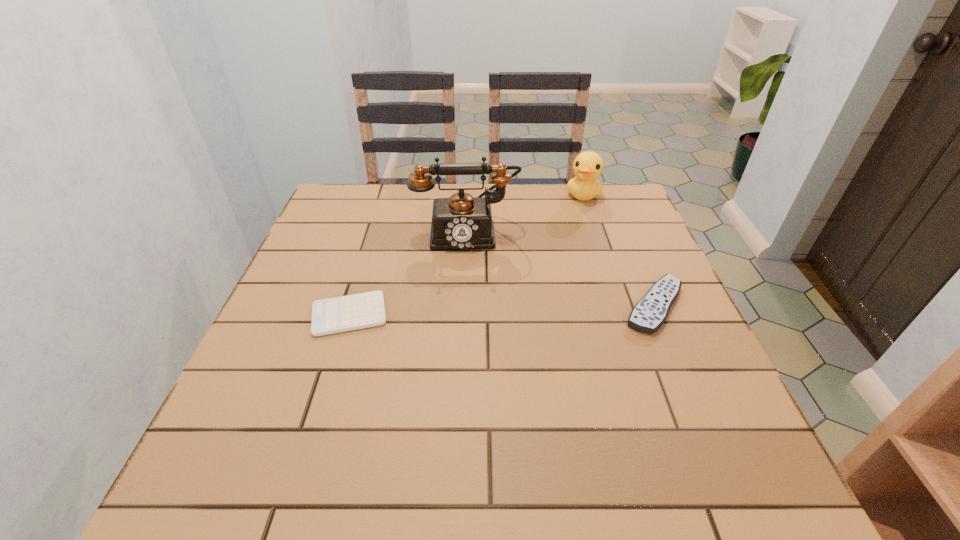
The width and height of the screenshot is (960, 540). Identify the location of object at the far right corner. (587, 166).

Identify the location of vacant area at the far edge. (393, 210).

Where is `vacant area at the near edge of the desktop`? The height and width of the screenshot is (540, 960). vacant area at the near edge of the desktop is located at coordinates (637, 413).

Locate an element on the screen. The image size is (960, 540). vacant position at the left edge of the desktop is located at coordinates (321, 279).

The height and width of the screenshot is (540, 960). In the image, there is a desktop. Identify the location of free region at the right edge. (628, 279).

I want to click on vacant area at the far left corner, so click(x=317, y=225).

I want to click on free space at the near left corner of the desktop, so click(310, 400).

Where is `empty space that is in between the remote control and the second farthest object`? The height and width of the screenshot is (540, 960). empty space that is in between the remote control and the second farthest object is located at coordinates (561, 269).

Identify the location of vacant space that's between the duck and the third object from right to left. 525,214.

The image size is (960, 540). Find the location of `free space between the remote control and the shortest object`. free space between the remote control and the shortest object is located at coordinates (502, 310).